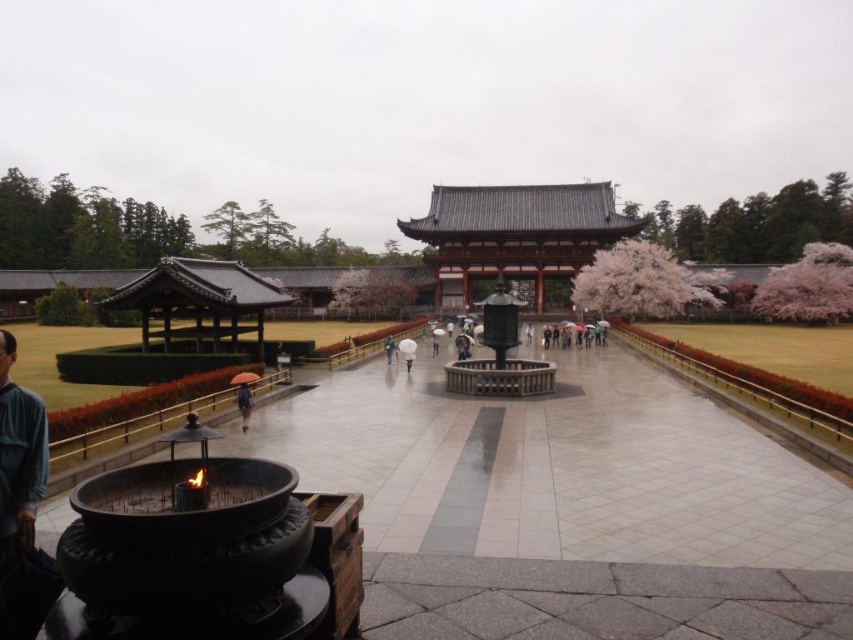
You are a visitor at the temple and want to know which umbrella is closer to the ground. Based on the scene, which one is lower between the blue fabric umbrella at lower left and the orange fabric umbrella at center?

The blue fabric umbrella at lower left is below the orange fabric umbrella at center, so it is closer to the ground.

You are a visitor at the temple and want to take a photo of both the matte gray wooden palace at center and the orange fabric umbrella at center. Which object should you focus on first to ensure both are in the frame?

Since the matte gray wooden palace at center is larger than the orange fabric umbrella at center, you should focus on the matte gray wooden palace at center first to ensure both fit in the frame.